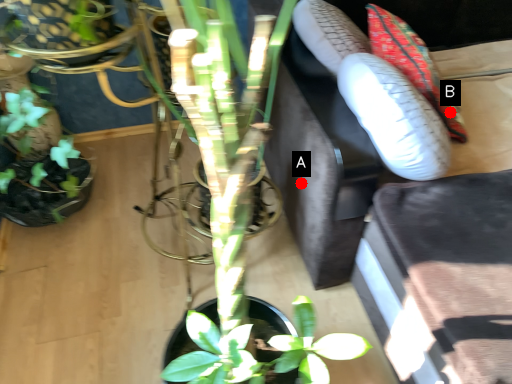
Question: Two points are circled on the image, labeled by A and B beside each circle. Which point appears closest to the camera in this image?

Choices:
 (A) A is closer
 (B) B is closer

Answer: (B)